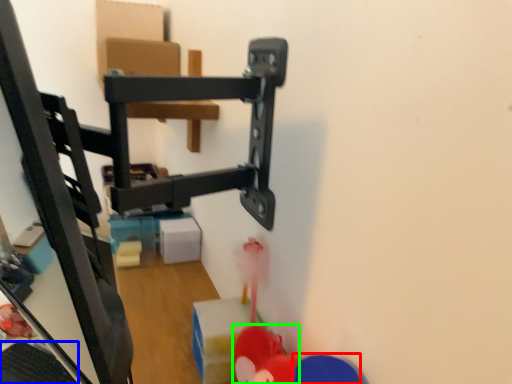
Question: Which is nearer to the toy (highlighted by a red box)? keyboard (highlighted by a blue box) or toy (highlighted by a green box).

Choices:
 (A) keyboard
 (B) toy

Answer: (B)